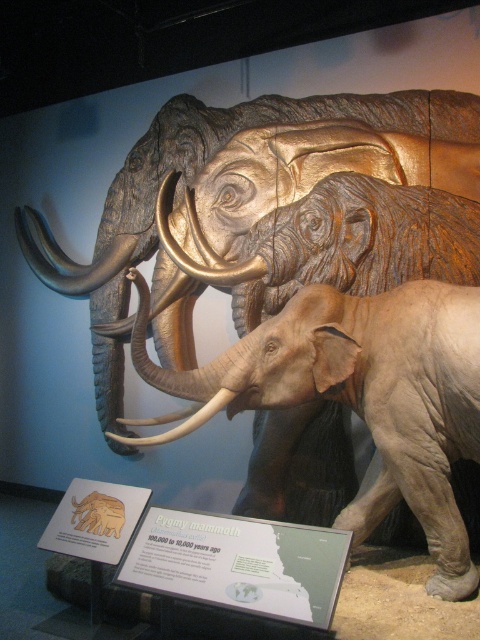
You are a museum visitor standing in front of the exhibit. You notice the matte gray elephant at center and the white ivory tusk at center. Which object is closer to you?

The matte gray elephant at center is closer to you because it is positioned over the white ivory tusk at center, indicating it is in front.